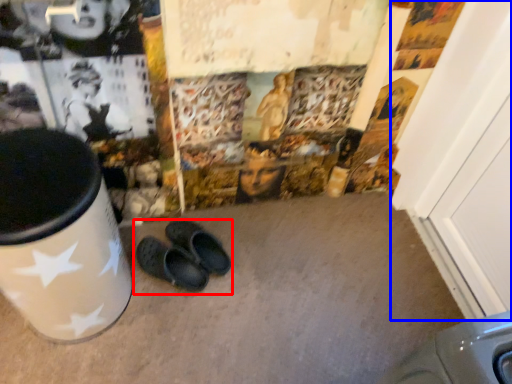
Question: Which of the following is the closest to the observer, footwear (highlighted by a red box) or door (highlighted by a blue box)?

Choices:
 (A) footwear
 (B) door

Answer: (B)